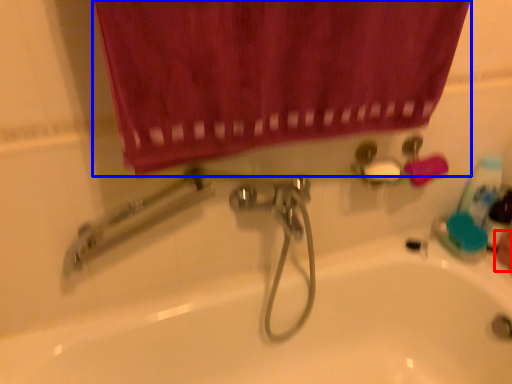
Question: Which of the following is the farthest to the observer, hand (highlighted by a red box) or curtain (highlighted by a blue box)?

Choices:
 (A) hand
 (B) curtain

Answer: (A)